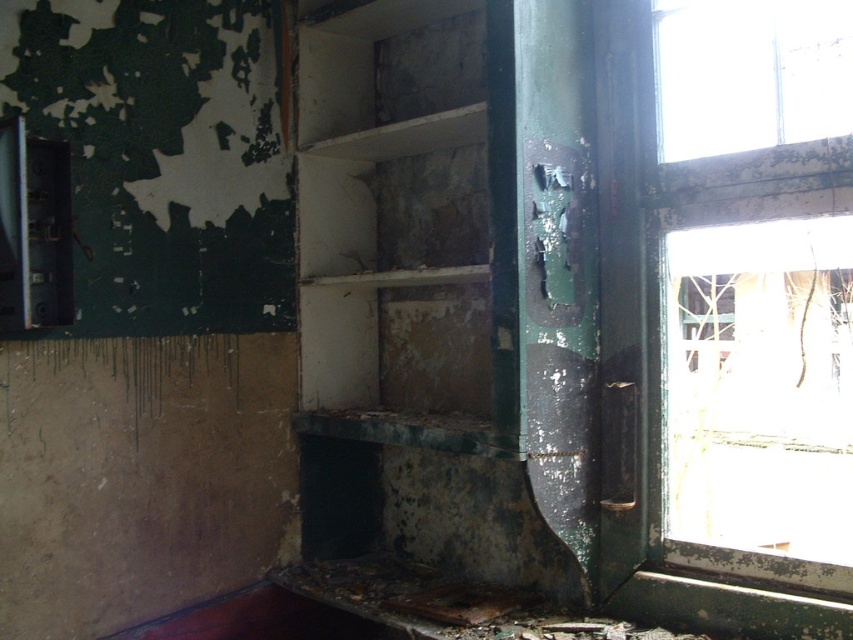
Question: Can you confirm if white matte shelf at center is positioned below green painted wood window at right?

Choices:
 (A) no
 (B) yes

Answer: (A)

Question: Which of the following is the closest to the observer?

Choices:
 (A) (511, 35)
 (B) (665, 448)

Answer: (A)

Question: Among these points, which one is nearest to the camera?

Choices:
 (A) (805, 170)
 (B) (471, 84)

Answer: (A)

Question: Which point appears closest to the camera in this image?

Choices:
 (A) (850, 180)
 (B) (457, 272)

Answer: (A)

Question: Is white matte shelf at center thinner than green painted wood window at right?

Choices:
 (A) no
 (B) yes

Answer: (A)

Question: Does white matte shelf at center appear on the right side of green painted wood window at right?

Choices:
 (A) yes
 (B) no

Answer: (B)